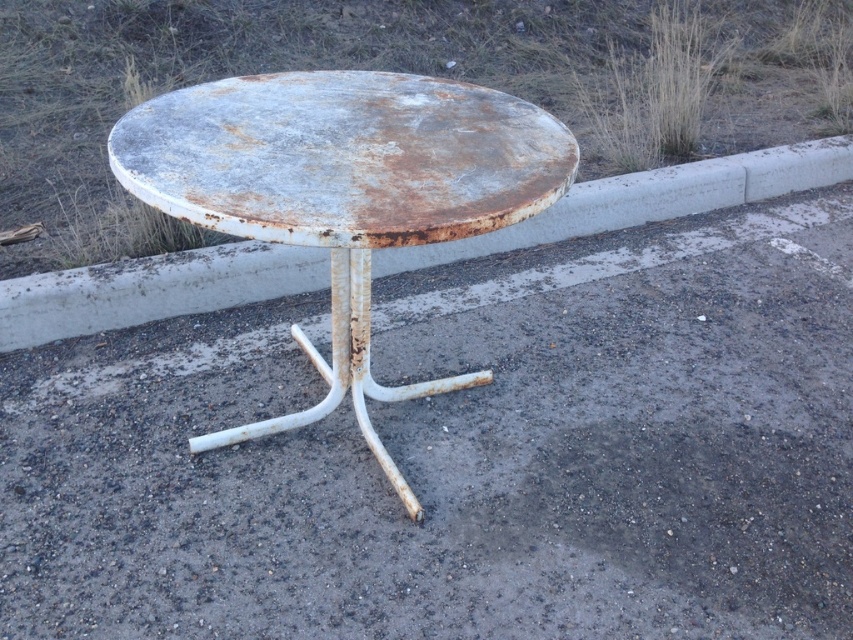
You are standing at the edge of the gravelly area and want to walk to the concrete curb at center. Which direction should you move relative to the rusty metal table at center?

You should move to the right of the rusty metal table at center because the concrete curb at center is to the right of the table.

You are standing at point 0.0, 0.0 in the image coordinate system. You want to walk to the rusty metal table at center. In which direction should you move?

You should move towards the point (344, 192) to reach the rusty metal table at center.

You are standing at the concrete curb to the left of the table and want to walk towards the table. Which point, point (444,198) or point (625,211), is closer to your starting position?

Point (444,198) is closer to your starting position because it is in front of point (625,211).